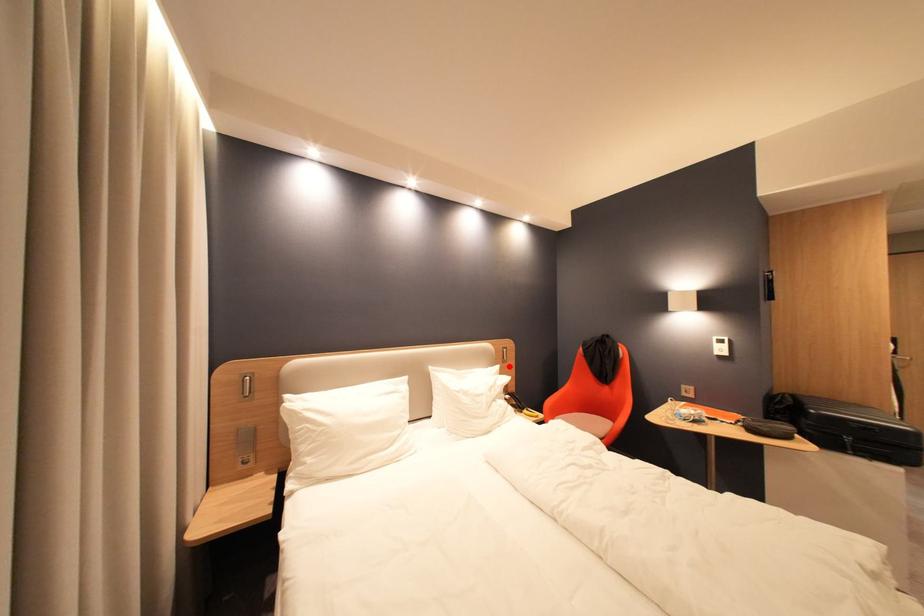
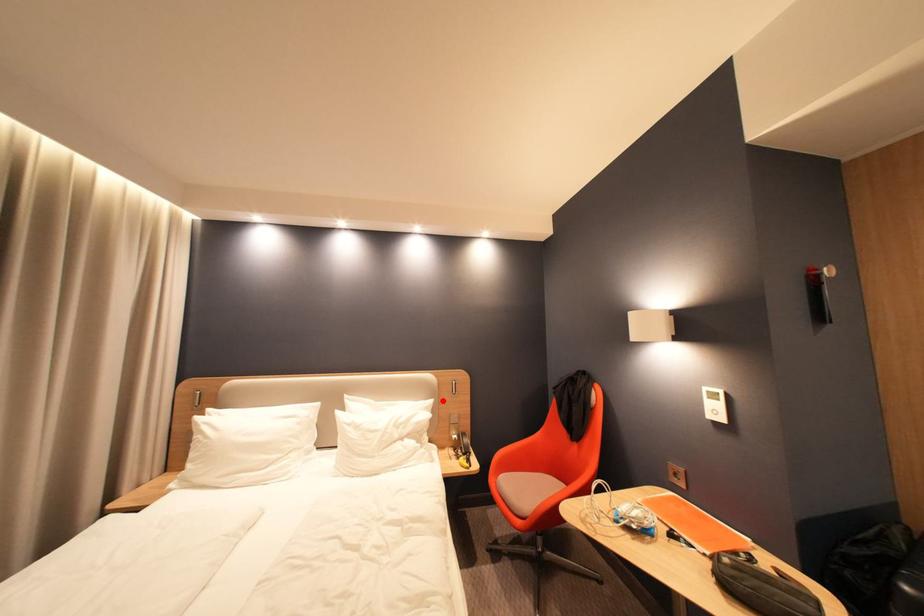
I am providing you with two images of the same scene from different viewpoints. A red point is marked on the first image and another point is marked on the second image. Does the point marked in image1 correspond to the same location as the one in image2?

Yes